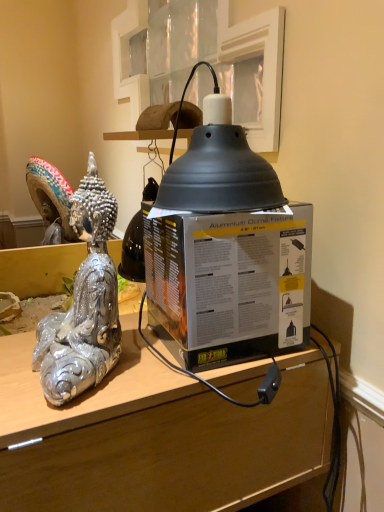
Question: From the image's perspective, does matte black dome at upper center appear higher than matte black box at center?

Choices:
 (A) no
 (B) yes

Answer: (B)

Question: Is matte black dome at upper center bigger than matte black box at center?

Choices:
 (A) yes
 (B) no

Answer: (B)

Question: Does matte black dome at upper center have a lesser width compared to matte black box at center?

Choices:
 (A) yes
 (B) no

Answer: (A)

Question: From the image's perspective, is matte black dome at upper center under matte black box at center?

Choices:
 (A) no
 (B) yes

Answer: (A)

Question: Is matte black dome at upper center with matte black box at center?

Choices:
 (A) yes
 (B) no

Answer: (B)

Question: Which is correct: shiny silver statue at left is inside matte black dome at upper center, or outside of it?

Choices:
 (A) inside
 (B) outside

Answer: (B)

Question: Would you say shiny silver statue at left is to the left or to the right of matte black dome at upper center in the picture?

Choices:
 (A) left
 (B) right

Answer: (A)

Question: In terms of size, does shiny silver statue at left appear bigger or smaller than matte black dome at upper center?

Choices:
 (A) big
 (B) small

Answer: (A)

Question: From the image's perspective, is shiny silver statue at left positioned above or below matte black dome at upper center?

Choices:
 (A) above
 (B) below

Answer: (B)

Question: From a real-world perspective, is matte black box at center physically located above or below matte black box at center?

Choices:
 (A) below
 (B) above

Answer: (A)

Question: Choose the correct answer: Is matte black box at center inside matte black box at center or outside it?

Choices:
 (A) inside
 (B) outside

Answer: (B)

Question: Based on their sizes in the image, would you say matte black box at center is bigger or smaller than matte black box at center?

Choices:
 (A) big
 (B) small

Answer: (A)

Question: In the image, is matte black box at center on the left side or the right side of matte black box at center?

Choices:
 (A) right
 (B) left

Answer: (B)

Question: Is matte black box at center situated inside shiny silver statue at left or outside?

Choices:
 (A) inside
 (B) outside

Answer: (B)

Question: From a real-world perspective, is matte black box at center above or below shiny silver statue at left?

Choices:
 (A) below
 (B) above

Answer: (A)